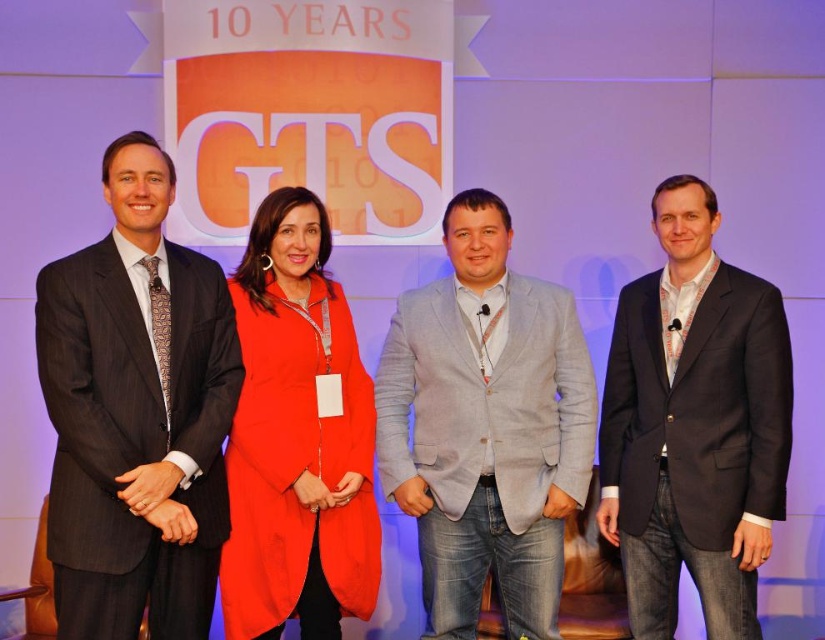
Question: Which object appears farthest from the camera in this image?

Choices:
 (A) dark gray pinstripe suit at left
 (B) matte orange coat at center
 (C) gray linen blazer at center
 (D) dark gray suit at right

Answer: (C)

Question: Which of the following is the farthest from the observer?

Choices:
 (A) (693, 513)
 (B) (550, 396)
 (C) (300, 227)
 (D) (159, 380)

Answer: (B)

Question: Can you confirm if gray linen blazer at center is positioned to the left of dark gray suit at right?

Choices:
 (A) yes
 (B) no

Answer: (A)

Question: Is gray linen blazer at center closer to camera compared to matte orange coat at center?

Choices:
 (A) yes
 (B) no

Answer: (B)

Question: Is the position of gray linen blazer at center less distant than that of dark gray suit at right?

Choices:
 (A) yes
 (B) no

Answer: (B)

Question: Estimate the real-world distances between objects in this image. Which object is closer to the gray linen blazer at center?

Choices:
 (A) dark gray pinstripe suit at left
 (B) matte orange coat at center
 (C) dark gray suit at right

Answer: (B)